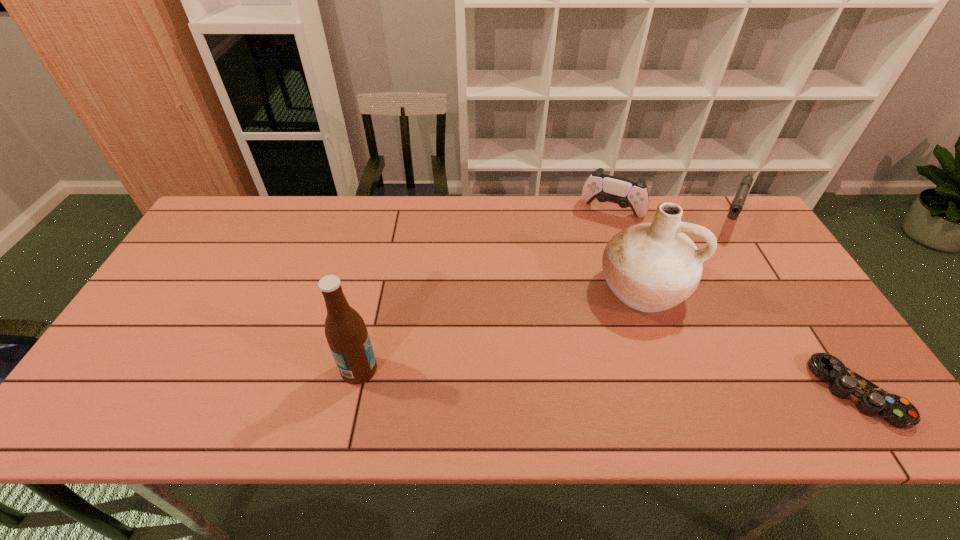
Image resolution: width=960 pixels, height=540 pixels. Identify the location of free space on the desktop that is between the beer bottle and the shorter control and is positioned to pour from the handle of the third farthest object. (612, 381).

The height and width of the screenshot is (540, 960). What are the coordinates of `free spot on the desktop that is between the leftmost object and the shorter control and is positioned in the direction the gun is aimed` in the screenshot? It's located at (662, 383).

Locate an element on the screen. The width and height of the screenshot is (960, 540). free space on the desktop that is between the beer bottle and the shortest object and is positioned on the front-facing side of the left control is located at coordinates (540, 377).